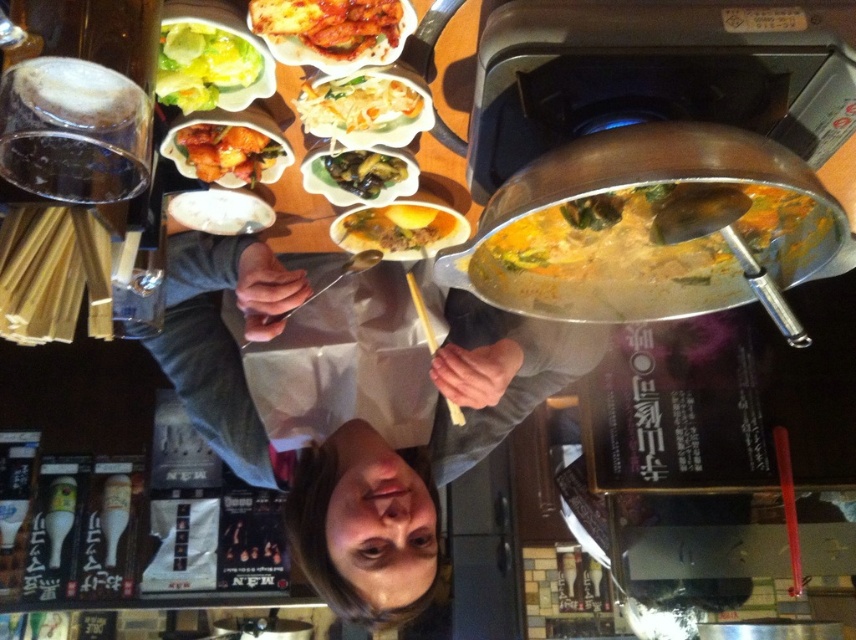
Does glazed glossy chicken at upper center appear over green leafy lettuce at upper left?

Indeed, glazed glossy chicken at upper center is positioned over green leafy lettuce at upper left.

Is point (343, 8) closer to camera compared to point (212, 86)?

Yes, point (343, 8) is in front of point (212, 86).

Which is behind, point (314, 38) or point (209, 68)?

Point (209, 68)

I want to click on glazed glossy chicken at upper center, so click(330, 26).

Measure the distance between glazed glossy chicken at upper center and golden crispy chicken at center.

glazed glossy chicken at upper center and golden crispy chicken at center are 7.80 inches apart.

Locate an element on the screen. This screenshot has width=856, height=640. glazed glossy chicken at upper center is located at coordinates (330, 26).

Between point (352, 36) and point (174, 132), which one is positioned in front?

Point (352, 36)

You are a GUI agent. You are given a task and a screenshot of the screen. Output one action in this format:
    pyautogui.click(x=<x>, y=<y>)
    Task: Click on the glazed glossy chicken at upper center
    The image size is (856, 640).
    Given the screenshot: What is the action you would take?
    pyautogui.click(x=330, y=26)

Is white creamy noodles at center wider than green glossy vegetables at center?

Yes.

Between white creamy noodles at center and green glossy vegetables at center, which one is positioned higher?

Positioned higher is white creamy noodles at center.

Does point (348, 92) come closer to viewer compared to point (370, 196)?

Yes, it is in front of point (370, 196).

Find the location of a particular element. This screenshot has height=640, width=856. white creamy noodles at center is located at coordinates (357, 106).